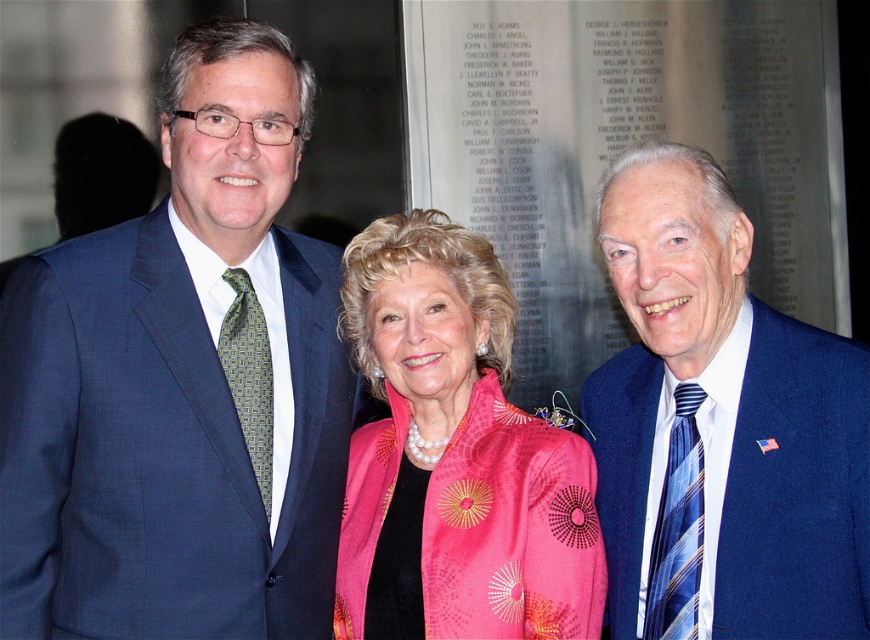
Question: Which point is closer to the camera?

Choices:
 (A) pink brocade scarf at center
 (B) blue striped tie at right

Answer: (B)

Question: Considering the real-world distances, which object is farthest from the blue textured suit at right?

Choices:
 (A) pink brocade scarf at center
 (B) blue striped tie at right

Answer: (A)

Question: Is pink brocade scarf at center to the right of greengeometric patterned fabrictie at left from the viewer's perspective?

Choices:
 (A) no
 (B) yes

Answer: (B)

Question: In this image, where is blue textured suit at right located relative to blue striped tie at right?

Choices:
 (A) below
 (B) above

Answer: (B)

Question: Which point appears closest to the camera in this image?

Choices:
 (A) (251, 128)
 (B) (730, 518)
 (C) (507, 572)
 (D) (270, 380)

Answer: (B)

Question: Does matte blue suit at left have a greater width compared to greengeometric patterned fabrictie at left?

Choices:
 (A) no
 (B) yes

Answer: (B)